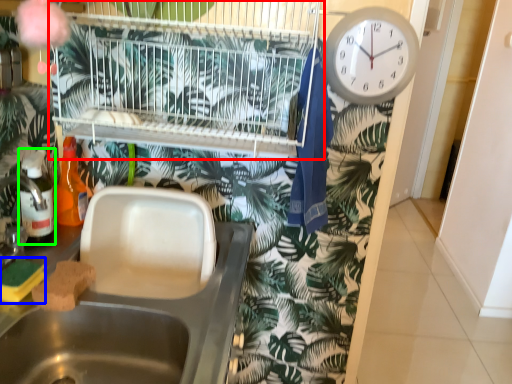
Question: Considering the real-world distances, which object is farthest from bird cage (highlighted by a red box)? food (highlighted by a blue box) or bottle (highlighted by a green box)?

Choices:
 (A) food
 (B) bottle

Answer: (A)